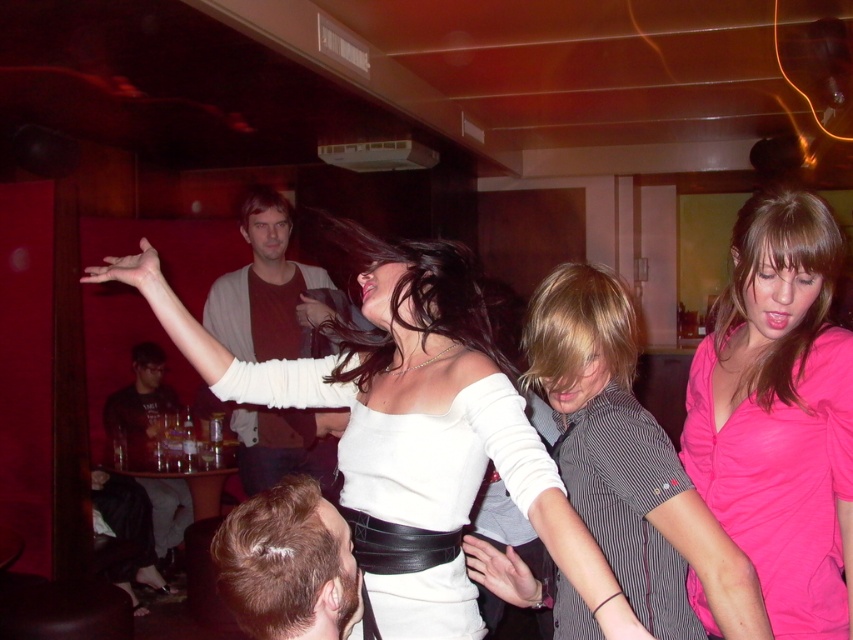
Question: Is matte brown shirt at center smaller than dark gray shirt at lower left?

Choices:
 (A) yes
 (B) no

Answer: (A)

Question: Is blonde hair at lower left closer to the viewer compared to dark gray shirt at lower left?

Choices:
 (A) yes
 (B) no

Answer: (A)

Question: Does white matte top at center appear under dark gray shirt at lower left?

Choices:
 (A) no
 (B) yes

Answer: (A)

Question: Which is nearer to the blonde hair at lower left?

Choices:
 (A) dark gray shirt at lower left
 (B) pink satin blouse at lower right
 (C) pink satin blouse at center

Answer: (C)

Question: Which point is closer to the camera taking this photo?

Choices:
 (A) (816, 502)
 (B) (444, 520)
 (C) (306, 516)

Answer: (C)

Question: Which point is farther to the camera?

Choices:
 (A) (689, 429)
 (B) (128, 442)

Answer: (B)